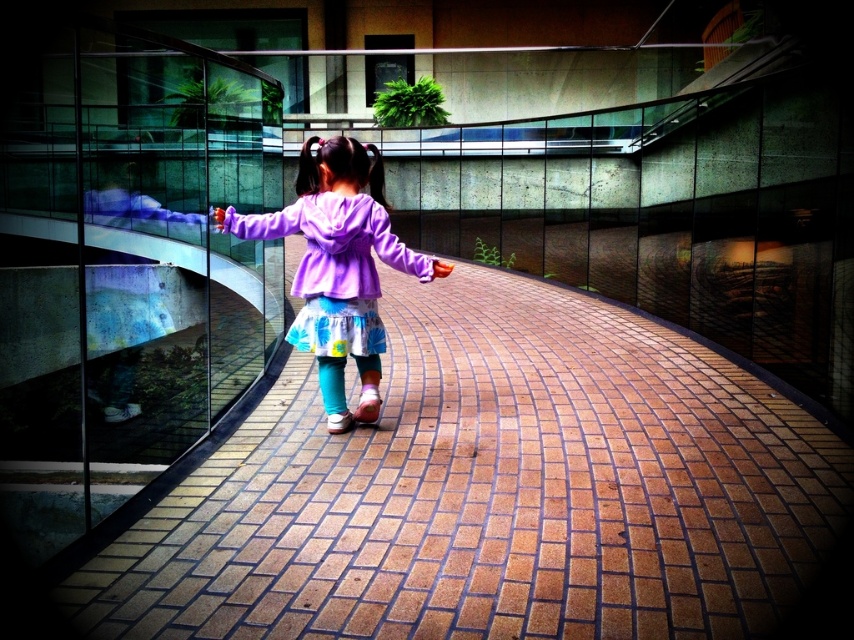
You are standing at the viewpoint of the camera. The brick at center and the purple fleece jacket at center are both in your line of sight. Which object is closer to you?

The brick at center is closer to the viewer than the purple fleece jacket at center.